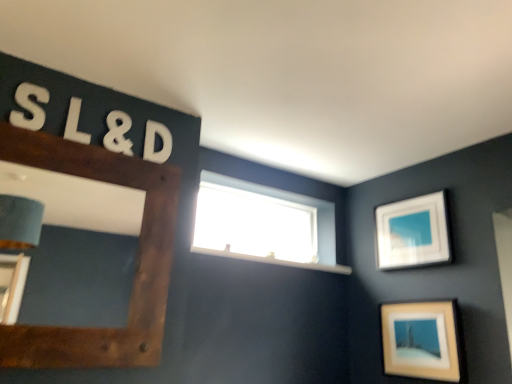
Question: Is matte white picture frame at lower right, the second picture frame when ordered from right to left, aimed at white foam letter l at upper left, which is counted as the 1th letter, starting from the front?

Choices:
 (A) no
 (B) yes

Answer: (B)

Question: Can you confirm if matte white picture frame at lower right, the second picture frame when ordered from right to left, is positioned to the right of white foam letter l at upper left, which is counted as the 1th letter, starting from the front?

Choices:
 (A) no
 (B) yes

Answer: (B)

Question: Considering the relative sizes of matte white picture frame at lower right, placed as the 2th picture frame when sorted from left to right, and white foam letter l at upper left, the first letter in the left-to-right sequence, in the image provided, is matte white picture frame at lower right, placed as the 2th picture frame when sorted from left to right, taller than white foam letter l at upper left, the first letter in the left-to-right sequence,?

Choices:
 (A) yes
 (B) no

Answer: (A)

Question: Is matte white picture frame at lower right, marked as the 2th picture frame in a back-to-front arrangement, oriented away from white foam letter l at upper left, the 2th letter positioned from the back?

Choices:
 (A) yes
 (B) no

Answer: (B)

Question: From a real-world perspective, is matte white picture frame at lower right, the second picture frame from the front, under white foam letter l at upper left, which is counted as the 1th letter, starting from the front?

Choices:
 (A) no
 (B) yes

Answer: (B)

Question: Would you say white foam ampersand at upper left, the 2th number from the left, is to the left or to the right of white foam letter s at upper left, which is the first number in front-to-back order, in the picture?

Choices:
 (A) right
 (B) left

Answer: (A)

Question: From a real-world perspective, is white foam ampersand at upper left, the 2th number from the left, above or below white foam letter s at upper left, positioned as the 2th number in back-to-front order?

Choices:
 (A) above
 (B) below

Answer: (A)

Question: Considering their positions, is white foam ampersand at upper left, which is the 2th number from front to back, located in front of or behind white foam letter s at upper left, which is the first number in front-to-back order?

Choices:
 (A) behind
 (B) front

Answer: (A)

Question: Do you think white foam ampersand at upper left, the 2th number from the left, is within white foam letter s at upper left, positioned as the 2th number in back-to-front order, or outside of it?

Choices:
 (A) outside
 (B) inside

Answer: (A)

Question: From a real-world perspective, is transparent glass window at upper center physically located above or below white foam letter l at upper left, the 2th letter positioned from the back?

Choices:
 (A) below
 (B) above

Answer: (A)

Question: Looking at their shapes, would you say transparent glass window at upper center is wider or thinner than white foam letter l at upper left, which is the 2th letter in right-to-left order?

Choices:
 (A) thin
 (B) wide

Answer: (B)

Question: Considering the positions of point (328, 213) and point (67, 127), is point (328, 213) closer or farther from the camera than point (67, 127)?

Choices:
 (A) farther
 (B) closer

Answer: (A)

Question: Based on their sizes in the image, would you say transparent glass window at upper center is bigger or smaller than white foam letter l at upper left, which is the 2th letter in right-to-left order?

Choices:
 (A) small
 (B) big

Answer: (B)

Question: Considering the positions of matte white picture frame at lower right, placed as the 2th picture frame when sorted from left to right, and transparent glass window at upper center in the image, is matte white picture frame at lower right, placed as the 2th picture frame when sorted from left to right, bigger or smaller than transparent glass window at upper center?

Choices:
 (A) big
 (B) small

Answer: (B)

Question: Is matte white picture frame at lower right, marked as the 2th picture frame in a back-to-front arrangement, taller or shorter than transparent glass window at upper center?

Choices:
 (A) short
 (B) tall

Answer: (B)